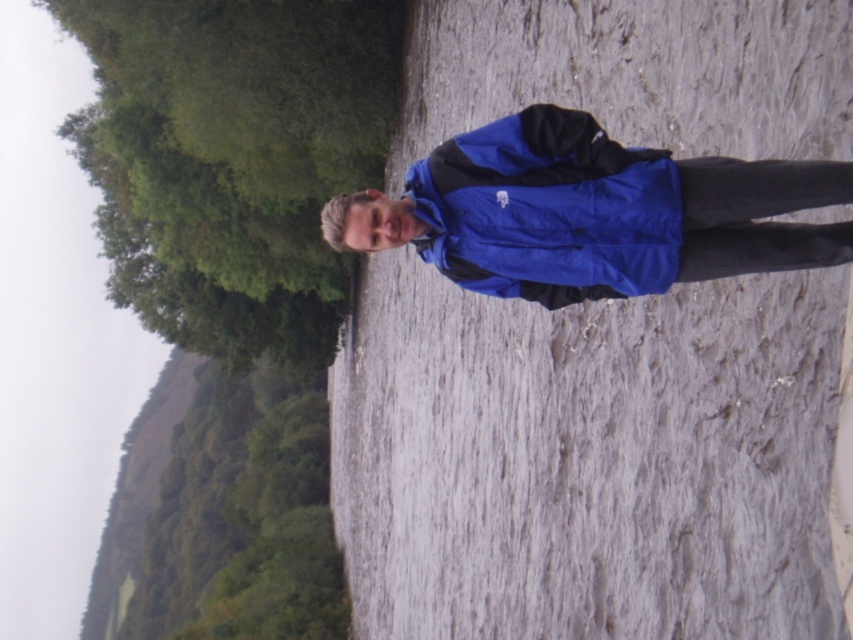
Question: Which object appears farthest from the camera in this image?

Choices:
 (A) blue synthetic jacket at center
 (B) blue fabric jacket at center

Answer: (A)

Question: Can you confirm if blue fabric jacket at center is positioned above blue synthetic jacket at center?

Choices:
 (A) no
 (B) yes

Answer: (A)

Question: In this image, where is blue fabric jacket at center located relative to blue synthetic jacket at center?

Choices:
 (A) left
 (B) right

Answer: (A)

Question: Can you confirm if blue fabric jacket at center is positioned to the left of blue synthetic jacket at center?

Choices:
 (A) yes
 (B) no

Answer: (A)